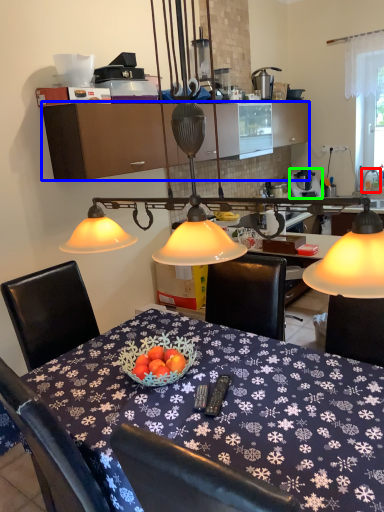
Question: Estimate the real-world distances between objects in this image. Which object is closer to faucet (highlighted by a red box), cabinetry (highlighted by a blue box) or appliance (highlighted by a green box)?

Choices:
 (A) cabinetry
 (B) appliance

Answer: (B)